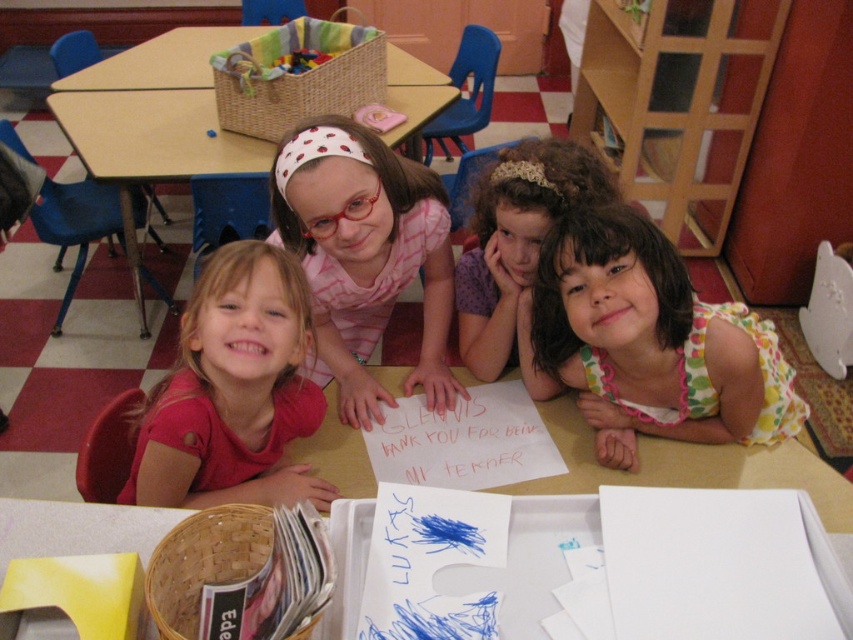
You are a teacher in the classroom and want to place a small plant on the table so that it is visible to all children. Considering the floral dress at center and the wooden table at center, which object should the plant be placed closer to for it to be seen by everyone?

The plant should be placed closer to the floral dress at center because it has a lesser height compared to the wooden table at center, ensuring the plant remains visible over the dress.

Looking at this image, you are a teacher organizing a classroom activity. You have a floral dress at center and a wooden table at center. If you need to move both items to a storage closet, which item would you move first if you want to save space?

The floral dress at center occupies less space than the wooden table at center, so moving the wooden table at center first would save more space.